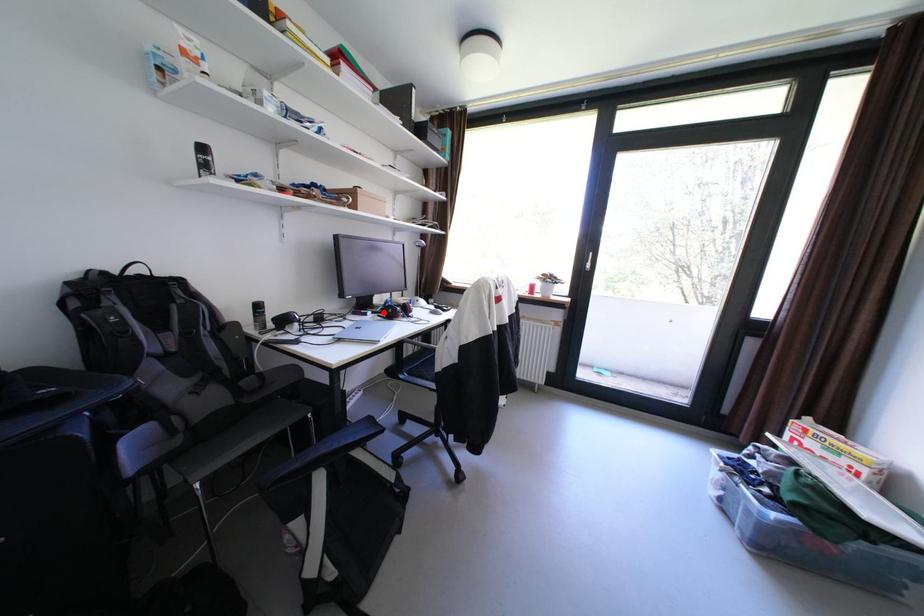
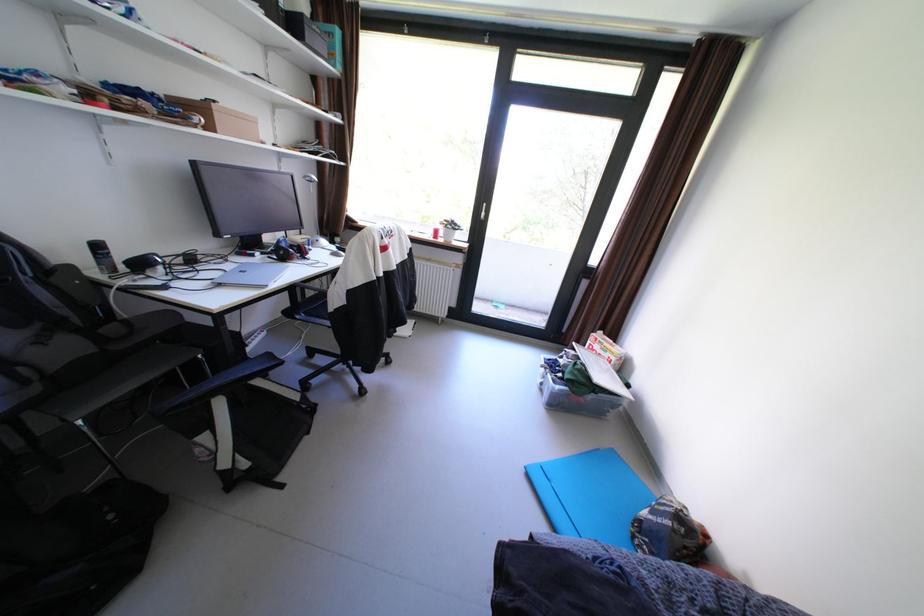
Where in the second image is the point corresponding to the highlighted location from the first image?

(274, 254)